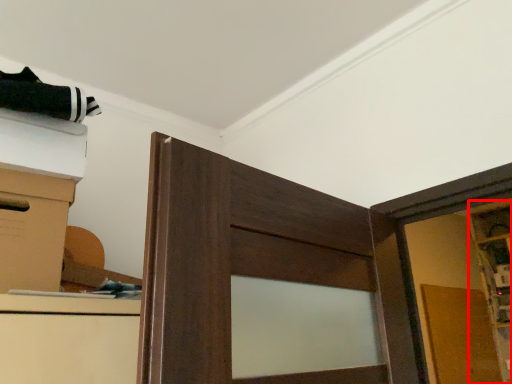
Question: From the image's perspective, considering the relative positions of cabinetry (annotated by the red box) and cardboard box in the image provided, where is cabinetry (annotated by the red box) located with respect to the staircase?

Choices:
 (A) above
 (B) below

Answer: (B)